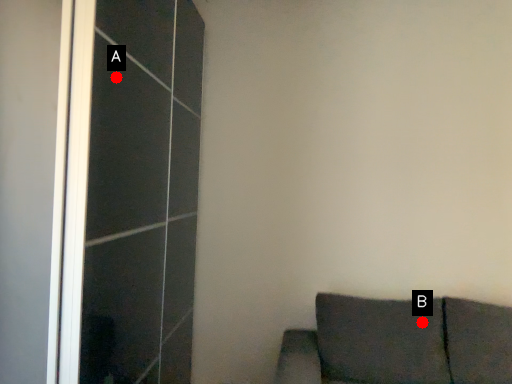
Question: Two points are circled on the image, labeled by A and B beside each circle. Which point appears farthest from the camera in this image?

Choices:
 (A) A is further
 (B) B is further

Answer: (B)